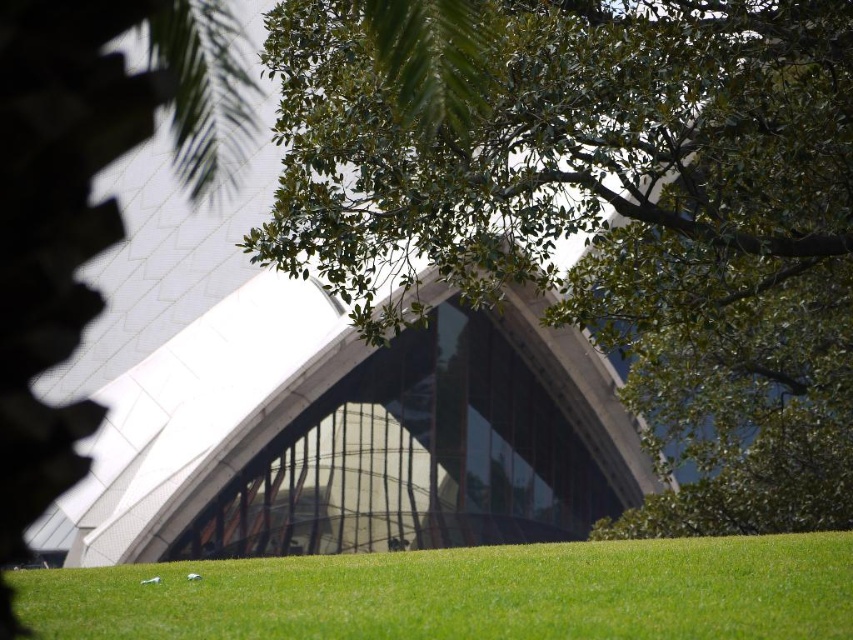
Question: Does green leafy tree at center appear on the left side of green grass at lower center?

Choices:
 (A) no
 (B) yes

Answer: (A)

Question: Is green leafy tree at center smaller than green grass at lower center?

Choices:
 (A) yes
 (B) no

Answer: (B)

Question: Which object is farther from the camera taking this photo?

Choices:
 (A) green grass at lower center
 (B) green leafy tree at center

Answer: (A)

Question: Among these points, which one is nearest to the camera?

Choices:
 (A) (744, 230)
 (B) (807, 592)

Answer: (B)

Question: Is green leafy tree at center smaller than green grass at lower center?

Choices:
 (A) no
 (B) yes

Answer: (A)